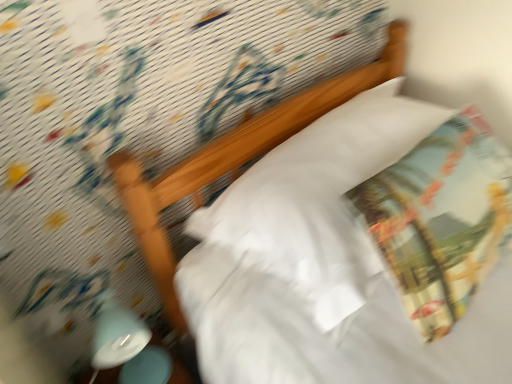
Locate an element on the screen. The image size is (512, 384). white soft pillow at center is located at coordinates (318, 201).

What are the coordinates of `white soft pillow at center` in the screenshot? It's located at (318, 201).

Is white glossy bedside lamp at lower left oriented towards printed fabric throw pillow at upper right?

No, white glossy bedside lamp at lower left is not turned towards printed fabric throw pillow at upper right.

Would you say white glossy bedside lamp at lower left is inside or outside printed fabric throw pillow at upper right?

white glossy bedside lamp at lower left is not enclosed by printed fabric throw pillow at upper right.

What's the angular difference between white glossy bedside lamp at lower left and printed fabric throw pillow at upper right's facing directions?

1.28 degrees separate the facing orientations of white glossy bedside lamp at lower left and printed fabric throw pillow at upper right.

How different are the orientations of white soft pillow at center and white glossy bedside lamp at lower left in degrees?

The angular difference between white soft pillow at center and white glossy bedside lamp at lower left is 1.27 degrees.

Is white soft pillow at center at the right side of white glossy bedside lamp at lower left?

Yes.

Is white soft pillow at center next to white glossy bedside lamp at lower left and touching it?

No, white soft pillow at center is not in contact with white glossy bedside lamp at lower left.

Is white soft pillow at center turned away from white glossy bedside lamp at lower left?

No, white soft pillow at center's orientation is not away from white glossy bedside lamp at lower left.

Can we say printed fabric throw pillow at upper right lies outside white soft pillow at center?

No, printed fabric throw pillow at upper right is inside white soft pillow at center's boundary.

Is printed fabric throw pillow at upper right positioned in front of white soft pillow at center?

Yes.

What's the angular difference between printed fabric throw pillow at upper right and white soft pillow at center's facing directions?

They differ by 0.00314 degrees in their facing directions.

Is printed fabric throw pillow at upper right far from white soft pillow at center?

No, printed fabric throw pillow at upper right is in close proximity to white soft pillow at center.

Is printed fabric throw pillow at upper right touching white glossy bedside lamp at lower left?

No.

Is printed fabric throw pillow at upper right aimed at white glossy bedside lamp at lower left?

No, printed fabric throw pillow at upper right does not turn towards white glossy bedside lamp at lower left.

Does printed fabric throw pillow at upper right have a lesser height compared to white glossy bedside lamp at lower left?

Yes, printed fabric throw pillow at upper right is shorter than white glossy bedside lamp at lower left.

Considering the relative positions of white soft pillow at center and printed fabric throw pillow at upper right in the image provided, is white soft pillow at center to the left or to the right of printed fabric throw pillow at upper right?

From the image, it's evident that white soft pillow at center is to the left of printed fabric throw pillow at upper right.

Which of these two, white soft pillow at center or printed fabric throw pillow at upper right, is thinner?

Thinner between the two is printed fabric throw pillow at upper right.

Is point (327, 274) in front of point (421, 296)?

Yes, it is in front of point (421, 296).

Is white soft pillow at center turned away from printed fabric throw pillow at upper right?

Yes, white soft pillow at center is facing away from printed fabric throw pillow at upper right.

Between white glossy bedside lamp at lower left and white soft pillow at center, which one has larger size?

white soft pillow at center is bigger.

From a real-world perspective, is white glossy bedside lamp at lower left positioned under white soft pillow at center based on gravity?

Yes, from a real-world perspective, white glossy bedside lamp at lower left is beneath white soft pillow at center.

Could you tell me if white glossy bedside lamp at lower left is turned towards white soft pillow at center?

No, white glossy bedside lamp at lower left is not turned towards white soft pillow at center.

You are a GUI agent. You are given a task and a screenshot of the screen. Output one action in this format:
    pyautogui.click(x=<x>, y=<y>)
    Task: Click on the bedside lamp below the printed fabric throw pillow at upper right (from a real-world perspective)
    This screenshot has width=512, height=384.
    Given the screenshot: What is the action you would take?
    pyautogui.click(x=127, y=346)

This screenshot has height=384, width=512. I want to click on pillow above the white glossy bedside lamp at lower left (from a real-world perspective), so click(318, 201).

Looking at the image, which one is located closer to printed fabric throw pillow at upper right, white soft pillow at center or white glossy bedside lamp at lower left?

Among the two, white soft pillow at center is located nearer to printed fabric throw pillow at upper right.

Looking at the image, which one is located closer to white soft pillow at center, printed fabric throw pillow at upper right or white glossy bedside lamp at lower left?

Among the two, printed fabric throw pillow at upper right is located nearer to white soft pillow at center.

When comparing their distances from white glossy bedside lamp at lower left, does printed fabric throw pillow at upper right or white soft pillow at center seem closer?

Based on the image, white soft pillow at center appears to be nearer to white glossy bedside lamp at lower left.

Estimate the real-world distances between objects in this image. Which object is further from white soft pillow at center, white glossy bedside lamp at lower left or printed fabric throw pillow at upper right?

Among the two, white glossy bedside lamp at lower left is located further to white soft pillow at center.

Considering their positions, is white soft pillow at center positioned closer to white glossy bedside lamp at lower left than printed fabric throw pillow at upper right?

white soft pillow at center lies closer to white glossy bedside lamp at lower left than the other object.

Estimate the real-world distances between objects in this image. Which object is further from printed fabric throw pillow at upper right, white glossy bedside lamp at lower left or white soft pillow at center?

white glossy bedside lamp at lower left.

You are a GUI agent. You are given a task and a screenshot of the screen. Output one action in this format:
    pyautogui.click(x=<x>, y=<y>)
    Task: Click on the pillow between white glossy bedside lamp at lower left and printed fabric throw pillow at upper right from left to right
    Image resolution: width=512 pixels, height=384 pixels.
    Given the screenshot: What is the action you would take?
    pyautogui.click(x=318, y=201)